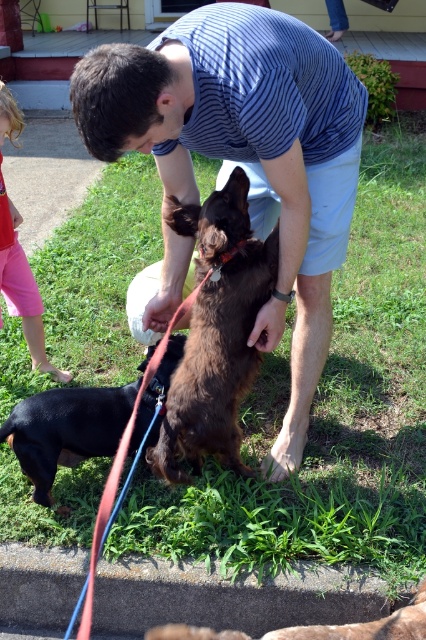
Question: Is pink cotton shorts at lower left thinner than brown furry dog at lower center?

Choices:
 (A) yes
 (B) no

Answer: (A)

Question: Does brown furry dog at center have a lesser width compared to pink cotton shorts at lower left?

Choices:
 (A) yes
 (B) no

Answer: (A)

Question: Which point is farther from the camera taking this photo?

Choices:
 (A) (86, 444)
 (B) (216, 634)
 (C) (213, 422)
 (D) (28, 266)

Answer: (D)

Question: Which of these objects is positioned closest to the black smooth dog at lower left?

Choices:
 (A) brown furry dog at center
 (B) striped cotton shirt at center

Answer: (A)

Question: Can you confirm if striped cotton shirt at center is thinner than black smooth dog at lower left?

Choices:
 (A) yes
 (B) no

Answer: (B)

Question: Which object is the closest to the striped cotton shirt at center?

Choices:
 (A) brown furry dog at center
 (B) brown furry dog at lower center

Answer: (A)